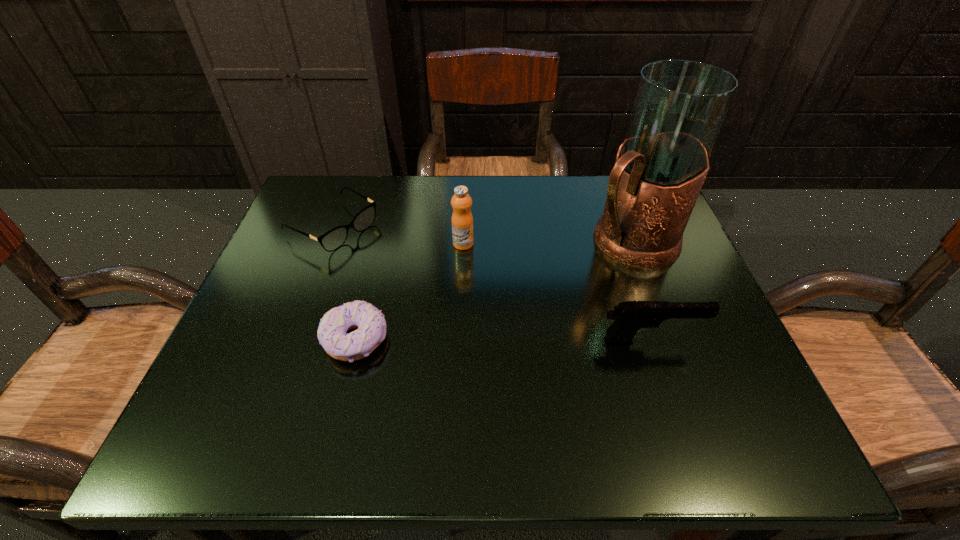
The height and width of the screenshot is (540, 960). I want to click on vacant point located between the third tallest object and the spectacles, so click(492, 283).

Identify which object is located as the fourth nearest to the third tallest object. Please provide its 2D coordinates. Your answer should be formatted as a tuple, i.e. [(x, y)], where the tuple contains the x and y coordinates of a point satisfying the conditions above.

[(333, 239)]

The width and height of the screenshot is (960, 540). I want to click on object identified as the third closest to the doughnut, so click(630, 316).